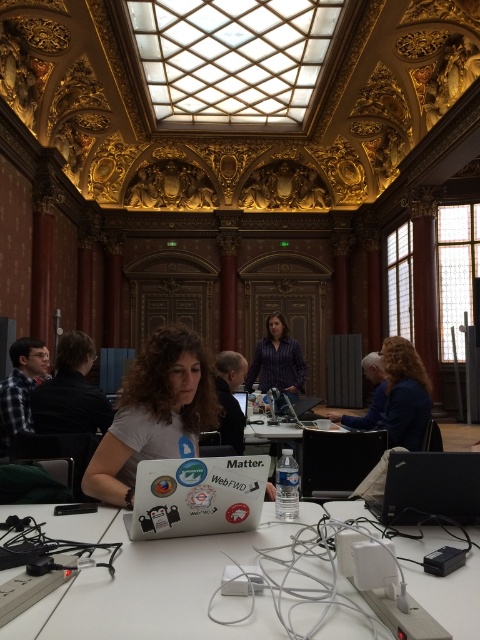
You are a photographer trying to capture a clear shot of the black glossy laptop at center without the white matte shirt at center blocking it. Based on their sizes, which object should you focus on to ensure the laptop is visible?

The white matte shirt at center is larger in size than the black glossy laptop at center, so focusing on the black glossy laptop at center would ensure it is visible without obstruction from the larger shirt.

Consider the image. You are standing in the grand ornately decorated room with intricate gold detailing. You need to place a new table at point (x=144, y=584). Is there already a table at that location?

Yes, there is already a white plastic table at center located at point (x=144, y=584).